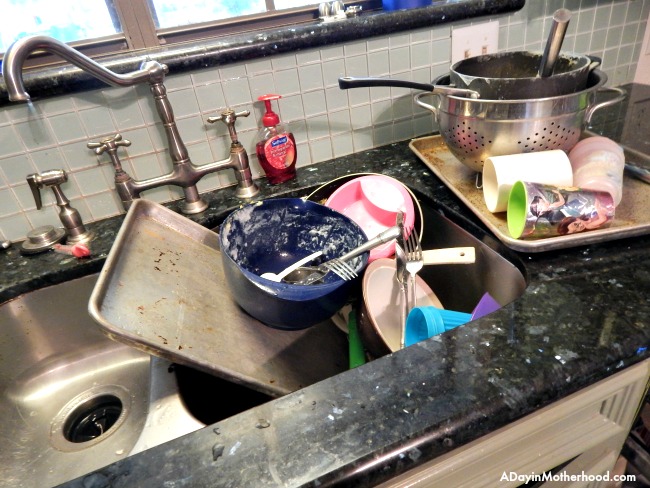
I want to click on countertop, so click(444, 418).